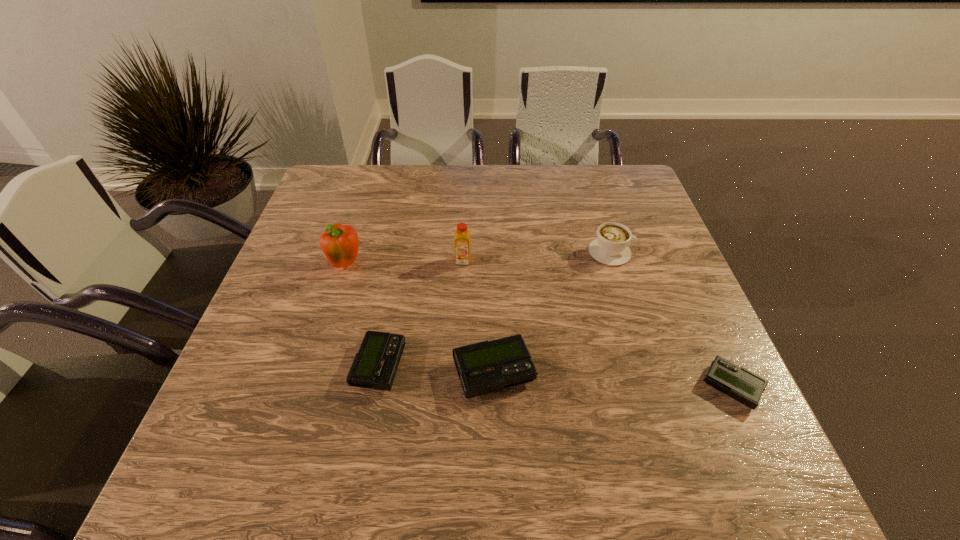
Find the location of `the second tallest beeper`. the second tallest beeper is located at coordinates (375, 365).

Image resolution: width=960 pixels, height=540 pixels. Find the location of `the fifth object from right to left`. the fifth object from right to left is located at coordinates (375, 365).

Image resolution: width=960 pixels, height=540 pixels. What are the coordinates of `the fourth tallest object` in the screenshot? It's located at (484, 367).

Locate an element on the screen. This screenshot has height=540, width=960. the second beeper from right to left is located at coordinates pyautogui.click(x=484, y=367).

Find the location of `the shortest beeper`. the shortest beeper is located at coordinates (736, 382).

Locate an element on the screen. the shortest object is located at coordinates coord(736,382).

You are a GUI agent. You are given a task and a screenshot of the screen. Output one action in this format:
    pyautogui.click(x=<x>, y=<y>)
    Task: Click on the pepper
    
    Given the screenshot: What is the action you would take?
    pyautogui.click(x=340, y=243)

Find the location of a particular element. the leftmost object is located at coordinates (340, 243).

Identify the location of the fifth shortest object. (462, 236).

Find the location of a particular element. This screenshot has width=960, height=540. the fourth shortest object is located at coordinates (611, 247).